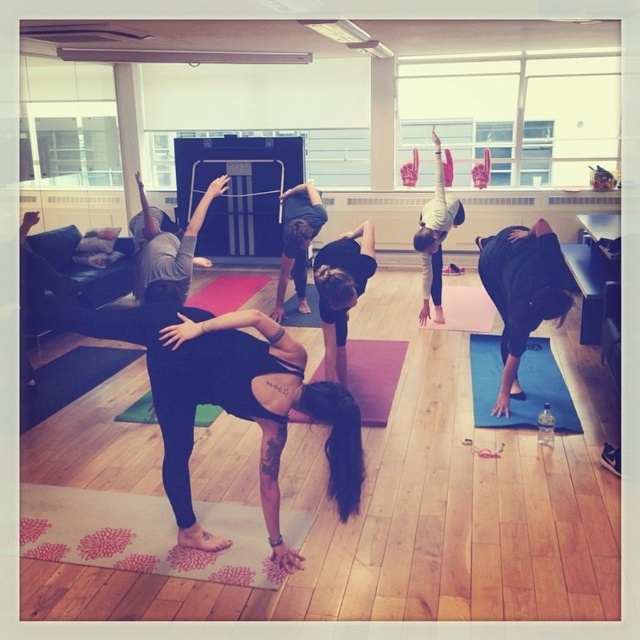
How distant is pink rubber yoga mat at center from black matte leggings at center?

A distance of 1.18 meters exists between pink rubber yoga mat at center and black matte leggings at center.

Is point (364, 403) positioned in front of point (308, 224)?

Yes, point (364, 403) is closer to viewer.

Who is more forward, (x=353, y=368) or (x=285, y=189)?

Point (x=353, y=368) is more forward.

You are a GUI agent. You are given a task and a screenshot of the screen. Output one action in this format:
    pyautogui.click(x=<x>, y=<y>)
    Task: Click on the pink rubber yoga mat at center
    
    Given the screenshot: What is the action you would take?
    pyautogui.click(x=372, y=376)

Who is positioned more to the left, black matte leggings at center or white matte yoga mat at center?

black matte leggings at center is more to the left.

Does point (296, 273) come farther from viewer compared to point (420, 236)?

Yes, it is.

Where is `black matte leggings at center`? This screenshot has height=640, width=640. black matte leggings at center is located at coordinates (298, 241).

This screenshot has height=640, width=640. What do you see at coordinates (522, 292) in the screenshot?
I see `black matte yoga mat at lower right` at bounding box center [522, 292].

Does black matte yoga mat at lower right lie behind blue rubber yoga mat at lower right?

No, black matte yoga mat at lower right is closer to the viewer.

Describe the element at coordinates (522, 292) in the screenshot. I see `black matte yoga mat at lower right` at that location.

Locate an element on the screen. The height and width of the screenshot is (640, 640). black matte yoga mat at lower right is located at coordinates (522, 292).